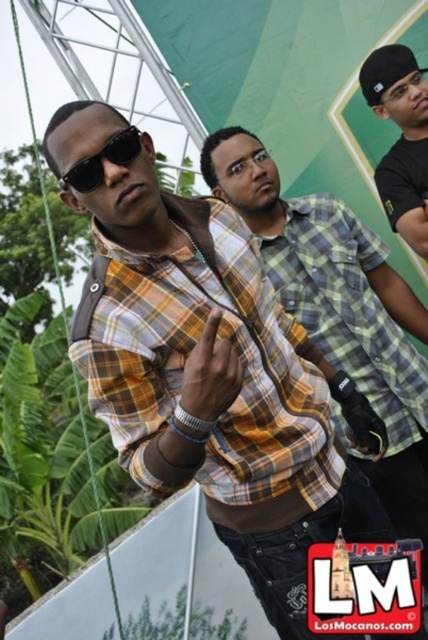
Is point (184, 320) closer to viewer compared to point (383, 182)?

Yes.

Does yellow plaid shirt at center have a lesser width compared to black matte cap at upper right?

No, yellow plaid shirt at center is not thinner than black matte cap at upper right.

Measure the distance between yellow plaid shirt at center and camera.

yellow plaid shirt at center is 1.46 meters from camera.

You are a GUI agent. You are given a task and a screenshot of the screen. Output one action in this format:
    pyautogui.click(x=<x>, y=<y>)
    Task: Click on the yellow plaid shirt at center
    The image size is (428, 640).
    Given the screenshot: What is the action you would take?
    [x=190, y=353]

Does point (415, 177) come behind point (101, 161)?

Yes, point (415, 177) is behind point (101, 161).

Does black matte cap at upper right have a larger size compared to black matte sunglasses at center?

Indeed, black matte cap at upper right has a larger size compared to black matte sunglasses at center.

Which is in front, point (404, 52) or point (85, 173)?

Positioned in front is point (85, 173).

The width and height of the screenshot is (428, 640). Find the location of `black matte cap at upper right`. black matte cap at upper right is located at coordinates (401, 140).

Can you confirm if yellow plaid shirt at center is positioned to the right of black matte sunglasses at center?

Indeed, yellow plaid shirt at center is positioned on the right side of black matte sunglasses at center.

Measure the distance between point (258, 307) and camera.

Point (258, 307) and camera are 1.85 meters apart.

Identify the location of yellow plaid shirt at center. (190, 353).